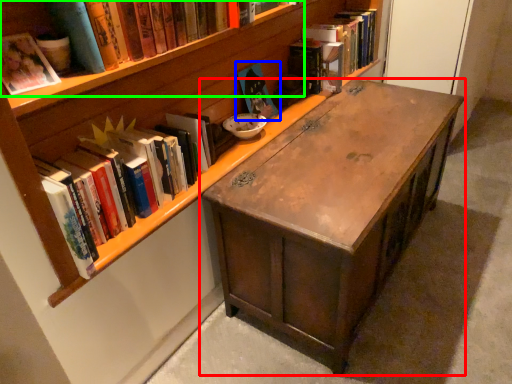
Question: Which is nearer to the desk (highlighted by a red box)? book (highlighted by a blue box) or book (highlighted by a green box).

Choices:
 (A) book
 (B) book

Answer: (A)